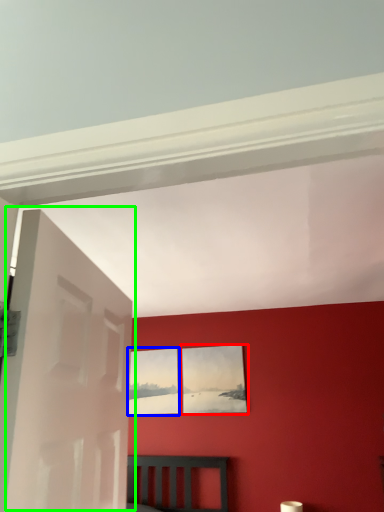
Question: Which object is positioned closest to picture frame (highlighted by a red box)? Select from picture frame (highlighted by a blue box) and door (highlighted by a green box).

Choices:
 (A) picture frame
 (B) door

Answer: (A)